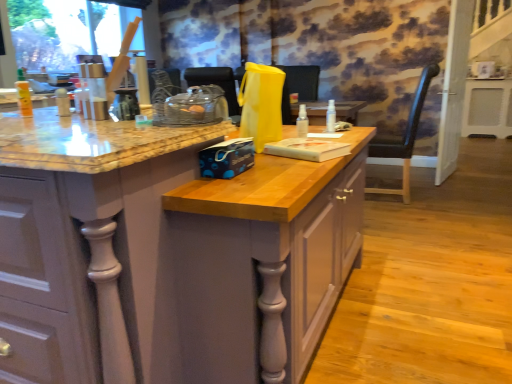
Where is `vacant area that lies in front of white glossy screen door at right`? vacant area that lies in front of white glossy screen door at right is located at coordinates (465, 188).